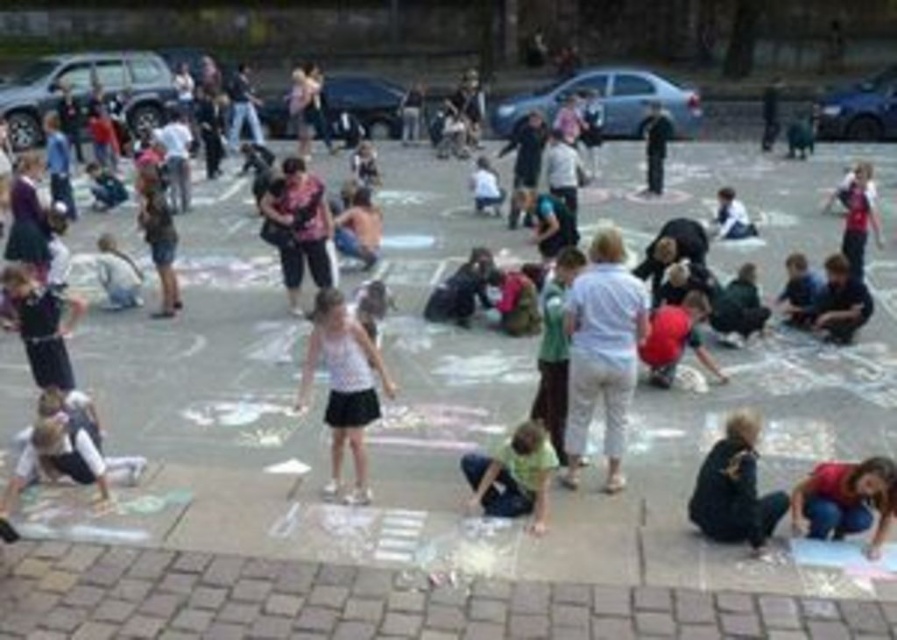
Question: Can you confirm if dark brown leather jacket at lower right is positioned below red denim jeans at lower right?

Choices:
 (A) no
 (B) yes

Answer: (A)

Question: Is white cotton shirt at center positioned before green cotton shirt at lower center?

Choices:
 (A) no
 (B) yes

Answer: (A)

Question: Which point appears closest to the camera in this image?

Choices:
 (A) (517, 445)
 (B) (849, 525)

Answer: (B)

Question: Can you confirm if white matte tank top at center is bigger than dark brown leather jacket at lower right?

Choices:
 (A) yes
 (B) no

Answer: (A)

Question: Which point is farther to the camera?

Choices:
 (A) white matte tank top at center
 (B) white cotton shirt at center

Answer: (B)

Question: Among these points, which one is farthest from the camera?

Choices:
 (A) (490, 472)
 (B) (565, 326)
 (C) (855, 477)

Answer: (B)